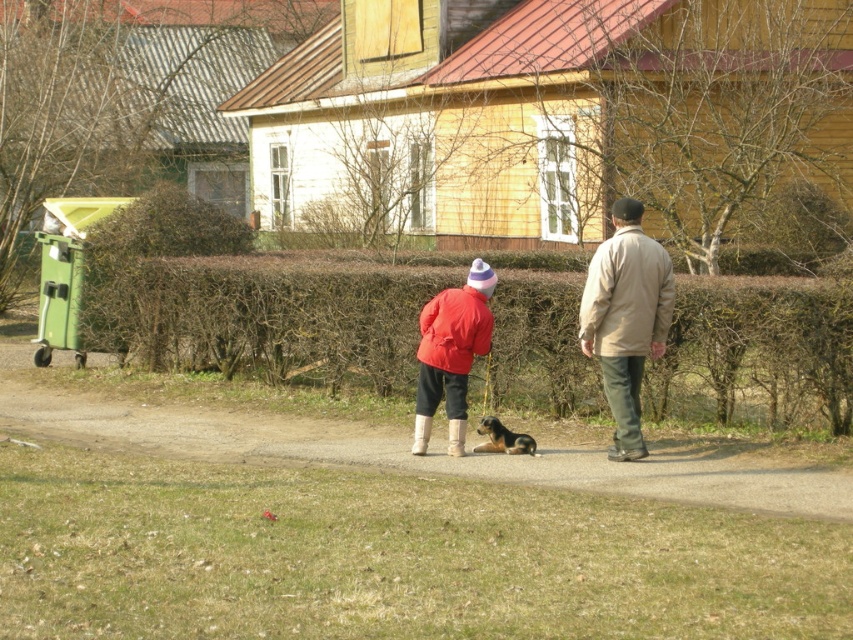
Question: Which object is positioned farthest from the brown fur dog at center?

Choices:
 (A) dirt path at center
 (B) matte red jacket at center
 (C) beige fabric jacket at center

Answer: (C)

Question: Among these points, which one is farthest from the camera?

Choices:
 (A) (117, 438)
 (B) (134, 308)
 (C) (480, 451)

Answer: (B)

Question: Can you confirm if brown textured hedge at center is positioned below dirt path at center?

Choices:
 (A) yes
 (B) no

Answer: (B)

Question: Is brown textured hedge at center thinner than dirt path at center?

Choices:
 (A) no
 (B) yes

Answer: (B)

Question: Can you confirm if matte red jacket at center is positioned to the left of brown fur dog at center?

Choices:
 (A) yes
 (B) no

Answer: (A)

Question: Based on their relative distances, which object is nearer to the brown fur dog at center?

Choices:
 (A) matte red jacket at center
 (B) dirt path at center
 (C) beige fabric jacket at center

Answer: (A)